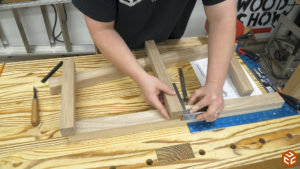
Identify the location of ladder. The width and height of the screenshot is (300, 169). pos(44,3).